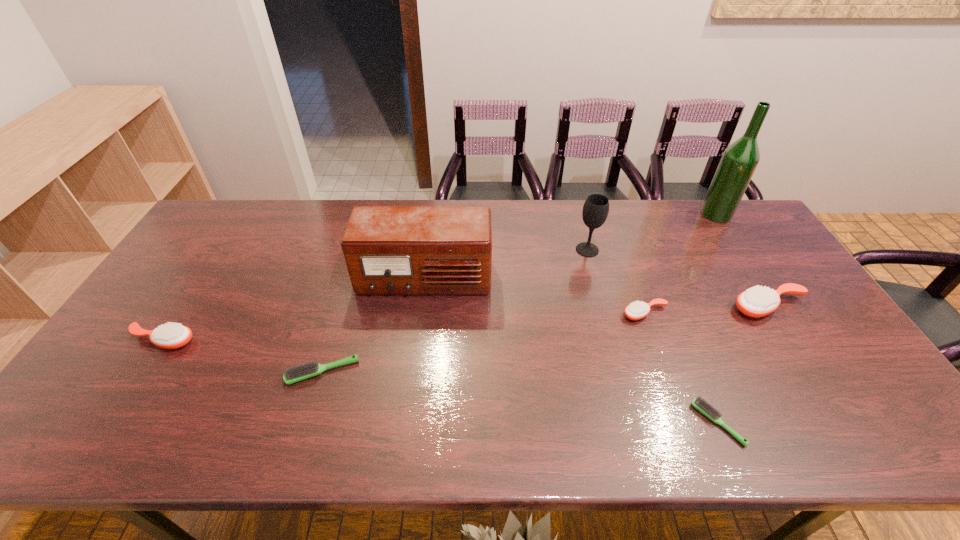
I want to click on vacant area that lies between the green alcohol and the second farthest object, so 652,232.

Locate an element on the screen. Image resolution: width=960 pixels, height=540 pixels. vacant region between the shortest hairbrush and the radio receiver is located at coordinates (571, 351).

The image size is (960, 540). I want to click on free point between the second orange hairbrush from left to right and the third nearest object, so click(404, 327).

You are a GUI agent. You are given a task and a screenshot of the screen. Output one action in this format:
    pyautogui.click(x=<x>, y=<y>)
    Task: Click on the free space between the nearest object and the third farthest hairbrush
    The width and height of the screenshot is (960, 540).
    Given the screenshot: What is the action you would take?
    pyautogui.click(x=441, y=382)

Locate which object ranks third in proximity to the bigger light hairbrush. Please provide its 2D coordinates. Your answer should be formatted as a tuple, i.e. [(x, y)], where the tuple contains the x and y coordinates of a point satisfying the conditions above.

[(636, 310)]

Locate an element on the screen. object that is the closest to the second nearest hairbrush is located at coordinates (388, 250).

Find the location of a particular element. the fourth closest hairbrush relative to the rightmost hairbrush is located at coordinates (172, 335).

The width and height of the screenshot is (960, 540). In order to click on hairbrush that is the second closest to the green alcohol in this screenshot , I will do `click(636, 310)`.

Select which orange hairbrush appears as the closest to the rightmost hairbrush. Please provide its 2D coordinates. Your answer should be formatted as a tuple, i.e. [(x, y)], where the tuple contains the x and y coordinates of a point satisfying the conditions above.

[(636, 310)]

Identify which orange hairbrush is located as the second nearest to the radio receiver. Please provide its 2D coordinates. Your answer should be formatted as a tuple, i.e. [(x, y)], where the tuple contains the x and y coordinates of a point satisfying the conditions above.

[(172, 335)]